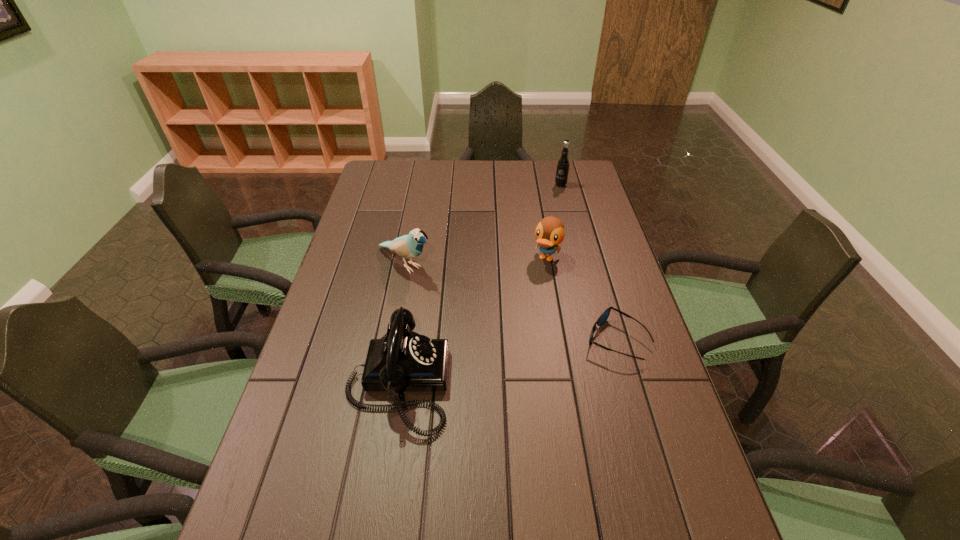
Where is `unoccupied position between the sunglasses and the farthest object`? unoccupied position between the sunglasses and the farthest object is located at coordinates (588, 262).

Locate an element on the screen. This screenshot has height=540, width=960. free space between the sunglasses and the telephone is located at coordinates (507, 361).

Locate an element on the screen. Image resolution: width=960 pixels, height=540 pixels. free space between the bird and the duck is located at coordinates (476, 261).

Find the location of a particular element. This screenshot has height=540, width=960. vacant region between the telephone and the duck is located at coordinates (472, 321).

Identify the location of free space between the shortest object and the farthest object. (588, 262).

The height and width of the screenshot is (540, 960). I want to click on free spot between the third object from left to right and the telephone, so click(472, 321).

Where is `free space between the telephone and the duck`? The image size is (960, 540). free space between the telephone and the duck is located at coordinates (472, 321).

Locate an element on the screen. This screenshot has height=540, width=960. unoccupied area between the root beer and the telephone is located at coordinates (479, 284).

You are a GUI agent. You are given a task and a screenshot of the screen. Output one action in this format:
    pyautogui.click(x=<x>, y=<y>)
    Task: Click on the blank region between the telephone and the duck
    Image resolution: width=960 pixels, height=540 pixels.
    Given the screenshot: What is the action you would take?
    pyautogui.click(x=472, y=321)

Locate which object ranks fourth in proximity to the third object from right to left. Please provide its 2D coordinates. Your answer should be formatted as a tuple, i.e. [(x, y)], where the tuple contains the x and y coordinates of a point satisfying the conditions above.

[(563, 163)]